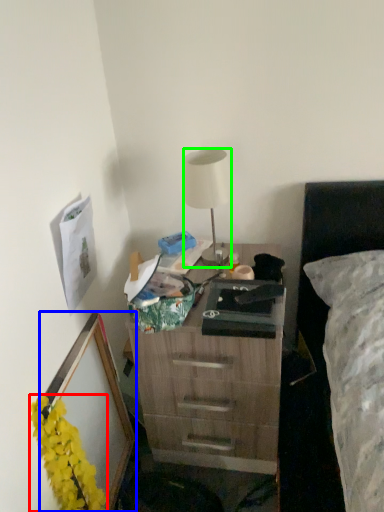
Question: Considering the real-world distances, which object is closest to flower (highlighted by a red box)? picture frame (highlighted by a blue box) or lamp (highlighted by a green box).

Choices:
 (A) picture frame
 (B) lamp

Answer: (A)